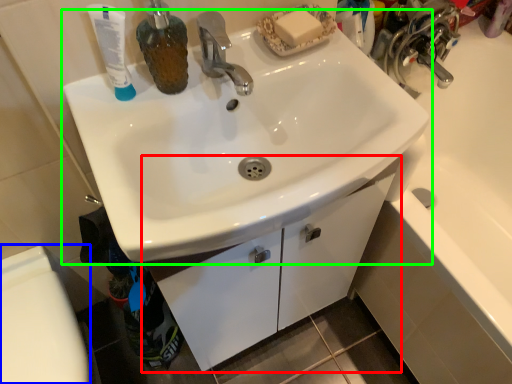
Question: Which object is the farthest from bathroom cabinet (highlighted by a red box)? Choose among these: toilet bowl (highlighted by a blue box) or sink (highlighted by a green box).

Choices:
 (A) toilet bowl
 (B) sink

Answer: (A)